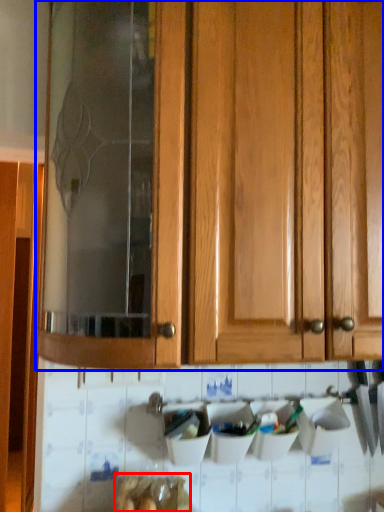
Question: Which object is further to the camera taking this photo, food (highlighted by a red box) or cabinetry (highlighted by a blue box)?

Choices:
 (A) food
 (B) cabinetry

Answer: (A)